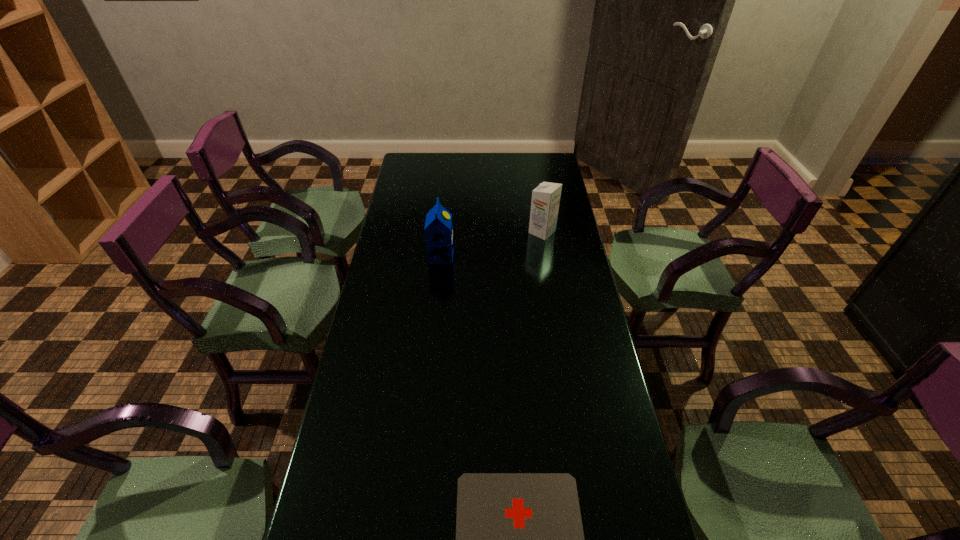
Identify the location of the nearer carton. The image size is (960, 540). (438, 230).

This screenshot has height=540, width=960. Find the location of `the left carton`. the left carton is located at coordinates (438, 230).

At what (x,y) coordinates should I click in order to perform the action: click on the farthest object. Please return your answer as a coordinate pair (x, y). Looking at the image, I should click on click(x=545, y=202).

Identify the location of the right carton. This screenshot has height=540, width=960. coord(545,202).

I want to click on free space located 0.200m with the cap open on the left carton, so click(x=507, y=255).

The height and width of the screenshot is (540, 960). In order to click on vacant space located 0.350m on the back of the farthest object in this screenshot , I will do `click(533, 178)`.

What are the coordinates of `object at the right edge` in the screenshot? It's located at (545, 202).

In the image, there is a desktop. Where is `free space at the far edge`? free space at the far edge is located at coordinates (505, 172).

In the image, there is a desktop. Where is `free space at the left edge`? This screenshot has height=540, width=960. free space at the left edge is located at coordinates (413, 187).

This screenshot has width=960, height=540. What are the coordinates of `vacant space at the right edge` in the screenshot? It's located at (561, 200).